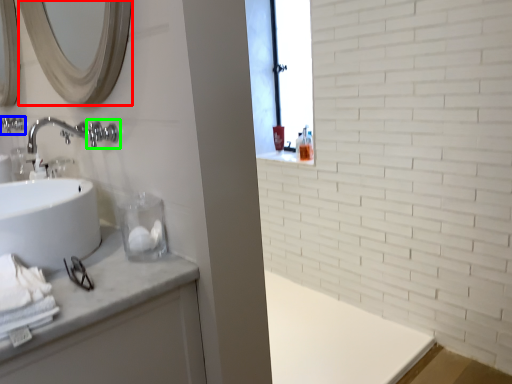
Question: Which object is the closest to the mirror (highlighted by a red box)? Choose among these: plumbing fixture (highlighted by a blue box) or plumbing fixture (highlighted by a green box).

Choices:
 (A) plumbing fixture
 (B) plumbing fixture

Answer: (B)